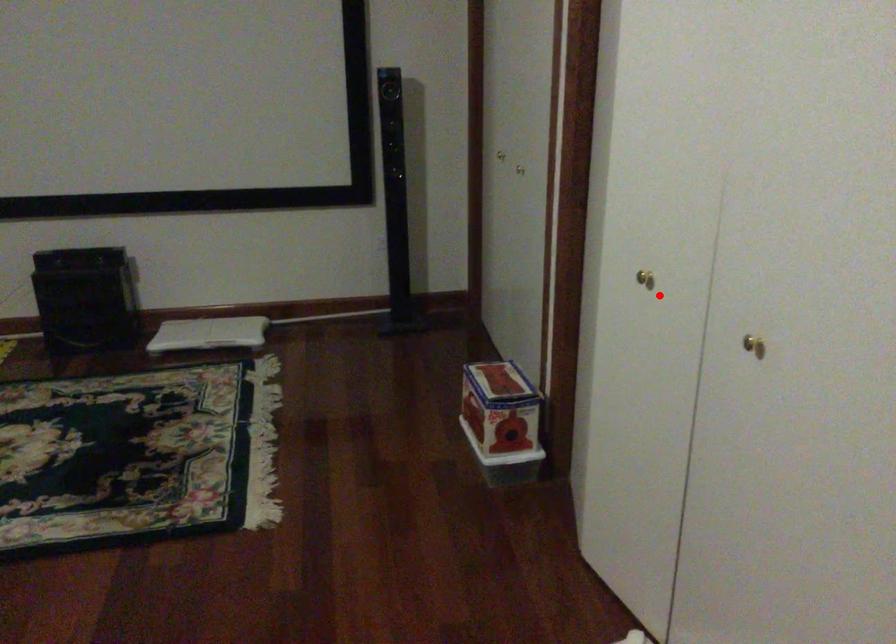
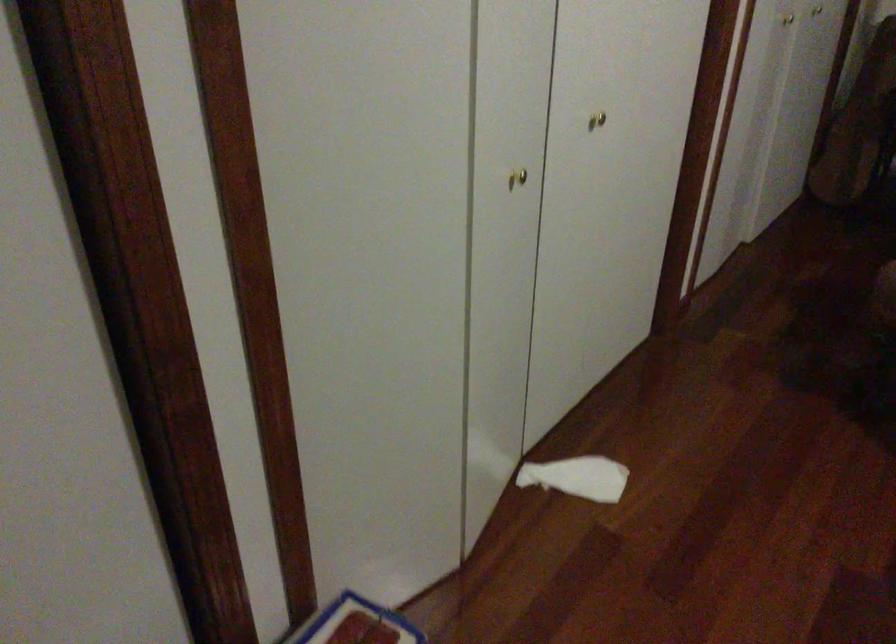
Where in the second image is the point corresponding to the highlighted location from the first image?

(517, 178)